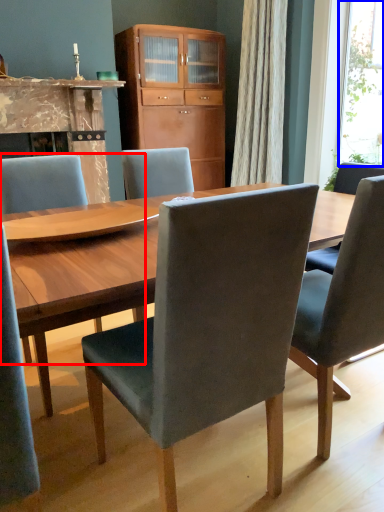
Question: Which of the following is the farthest to the observer, chair (highlighted by a red box) or window screen (highlighted by a blue box)?

Choices:
 (A) chair
 (B) window screen

Answer: (B)